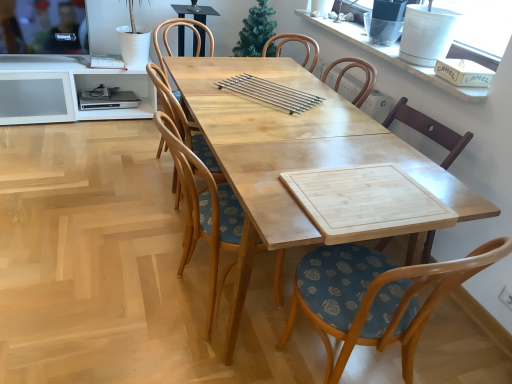
At what (x,y) coordinates should I click in order to perform the action: click on vacant space that is to the left of wooden chair with floral cushion at center, the second chair positioned from the front. Please return your answer as a coordinate pair (x, y). The image size is (512, 384). Looking at the image, I should click on (114, 293).